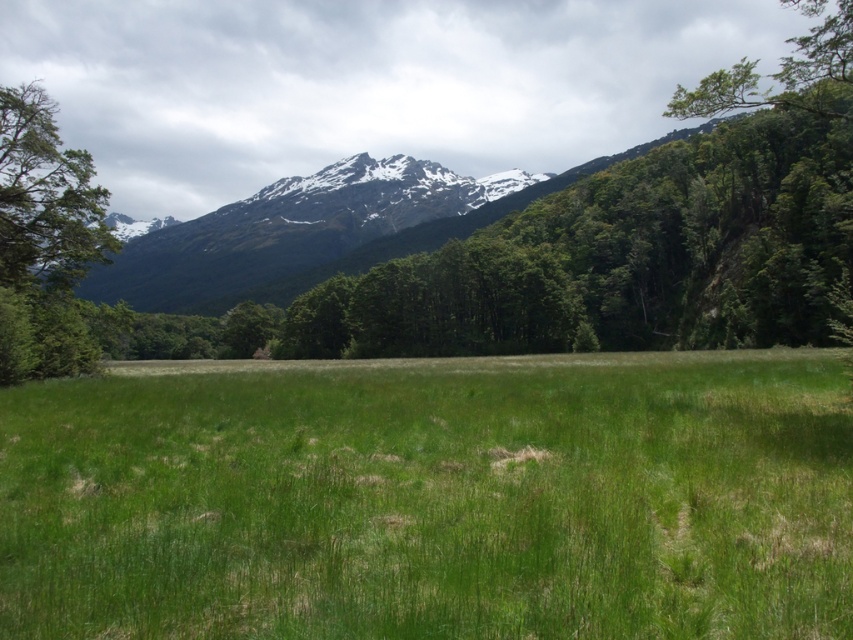
Can you confirm if green grassy pasture at center is positioned to the left of snowy rocky mountain at upper center?

In fact, green grassy pasture at center is to the right of snowy rocky mountain at upper center.

Is green grassy pasture at center closer to the viewer compared to snowy rocky mountain at upper center?

Yes.

You are a GUI agent. You are given a task and a screenshot of the screen. Output one action in this format:
    pyautogui.click(x=<x>, y=<y>)
    Task: Click on the green grassy pasture at center
    This screenshot has height=640, width=853.
    Given the screenshot: What is the action you would take?
    pyautogui.click(x=433, y=499)

Can you confirm if snowy rocky mountain at upper center is bigger than green leafy tree at left?

Actually, snowy rocky mountain at upper center might be smaller than green leafy tree at left.

Who is more forward, (415, 193) or (57, 282)?

Point (57, 282) is in front.

Image resolution: width=853 pixels, height=640 pixels. In order to click on snowy rocky mountain at upper center in this screenshot , I will do `click(288, 228)`.

Can you confirm if green grassy pasture at center is shorter than green leafy tree at left?

Yes, green grassy pasture at center is shorter than green leafy tree at left.

Is green grassy pasture at center in front of green leafy tree at left?

Yes.

Describe the element at coordinates (433, 499) in the screenshot. Image resolution: width=853 pixels, height=640 pixels. I see `green grassy pasture at center` at that location.

Identify the location of green grassy pasture at center. point(433,499).